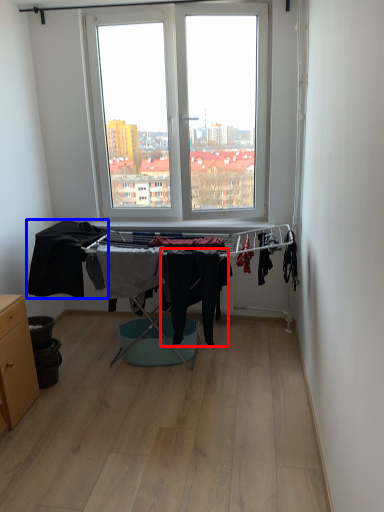
Question: Which point is further to the camera, clothing (highlighted by a red box) or clothing (highlighted by a blue box)?

Choices:
 (A) clothing
 (B) clothing

Answer: (B)